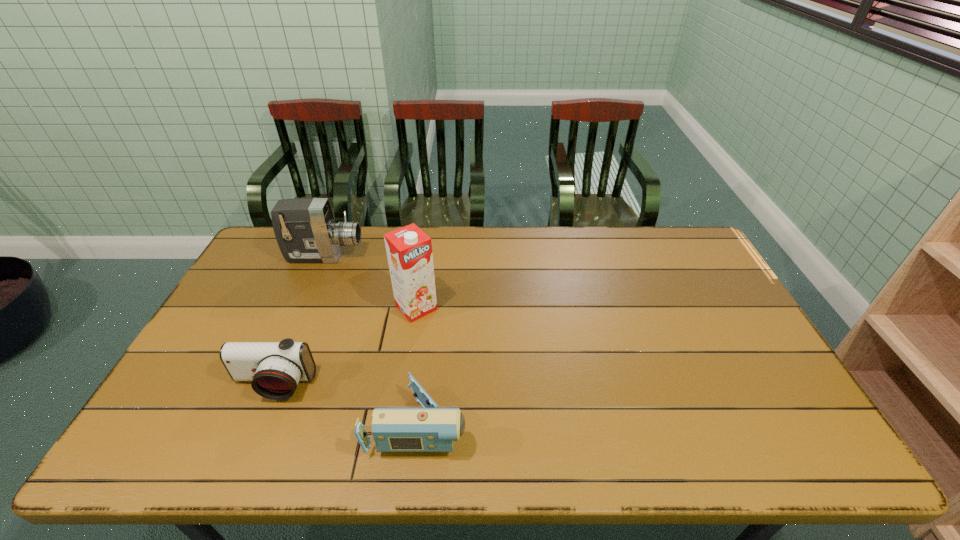
Locate an element on the screen. This screenshot has width=960, height=540. object present at the far left corner is located at coordinates (305, 229).

Find the location of `vacant space at the far edge of the desktop`. vacant space at the far edge of the desktop is located at coordinates (319, 267).

In the image, there is a desktop. Identify the location of blank space at the near edge. The image size is (960, 540). (552, 441).

At what (x,y) coordinates should I click in order to perform the action: click on free space at the left edge of the desktop. Please return your answer as a coordinate pair (x, y). Looking at the image, I should click on click(x=155, y=417).

You are a GUI agent. You are given a task and a screenshot of the screen. Output one action in this format:
    pyautogui.click(x=<x>, y=<y>)
    Task: Click on the blank space at the right edge
    This screenshot has height=540, width=960.
    Given the screenshot: What is the action you would take?
    pyautogui.click(x=727, y=302)

In the image, there is a desktop. Where is `free space at the near left corner`? The width and height of the screenshot is (960, 540). free space at the near left corner is located at coordinates (180, 434).

The width and height of the screenshot is (960, 540). In the image, there is a desktop. Find the location of `free space at the far right corner`. free space at the far right corner is located at coordinates (692, 251).

The height and width of the screenshot is (540, 960). Identify the location of free region at the near right corner. (784, 449).

I want to click on blank region between the rightmost camcorder and the second tallest object, so click(x=372, y=340).

Identify the location of unoccupied position between the rightmost camcorder and the farthest camcorder. (372, 340).